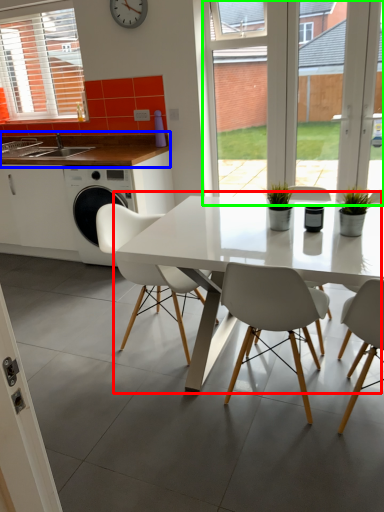
Question: Which is farther away from kitchen & dining room table (highlighted by a red box)? countertop (highlighted by a blue box) or glass door (highlighted by a green box)?

Choices:
 (A) countertop
 (B) glass door

Answer: (B)